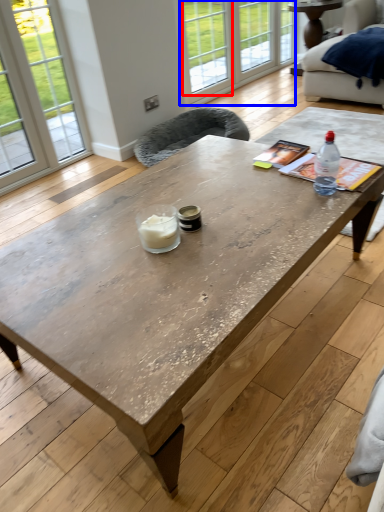
Question: Among these objects, which one is nearest to the camera, window (highlighted by a red box) or glass door (highlighted by a blue box)?

Choices:
 (A) window
 (B) glass door

Answer: (A)